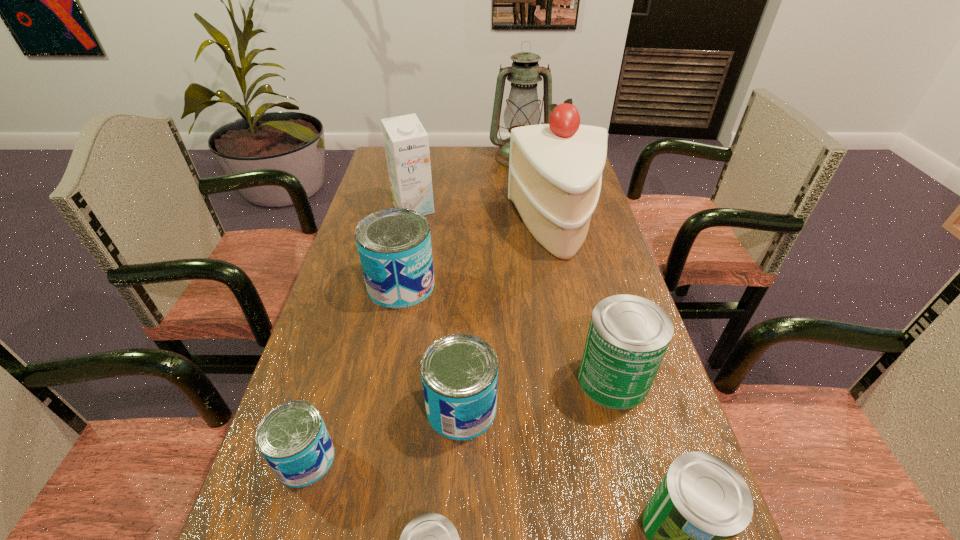
I want to click on can that is at the right edge, so click(628, 336).

Locate an element on the screen. This screenshot has height=540, width=960. object that is at the far right corner is located at coordinates tap(522, 109).

In the image, there is a desktop. Identify the location of free space at the left edge. tap(379, 201).

At what (x,y) coordinates should I click in order to perform the action: click on vacant area at the right edge. Please return your answer as a coordinate pair (x, y). The image size is (960, 540). Looking at the image, I should click on (591, 244).

At what (x,y) coordinates should I click in order to perform the action: click on vacant space in between the oil lamp and the carton. Please return your answer as a coordinate pair (x, y). Looking at the image, I should click on (467, 183).

Where is `free space that is in between the second biggest blue can and the carton`? free space that is in between the second biggest blue can and the carton is located at coordinates (438, 309).

Locate an element on the screen. The image size is (960, 540). unoccupied position between the carton and the tallest object is located at coordinates (467, 183).

Locate an element on the screen. This screenshot has width=960, height=540. object that is the sixth nearest to the third tallest object is located at coordinates (293, 439).

Point out which object is positioned as the fourth nearest to the second tallest object. Please provide its 2D coordinates. Your answer should be formatted as a tuple, i.e. [(x, y)], where the tuple contains the x and y coordinates of a point satisfying the conditions above.

[(628, 336)]

Identify the location of can that is the nearest to the farthest blue can. (459, 372).